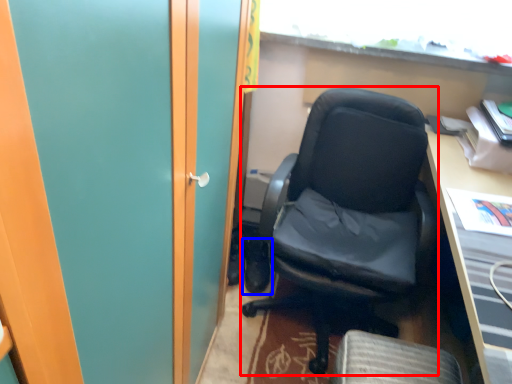
Question: Which of the following is the closest to the observer, chair (highlighted by a red box) or footwear (highlighted by a blue box)?

Choices:
 (A) chair
 (B) footwear

Answer: (A)